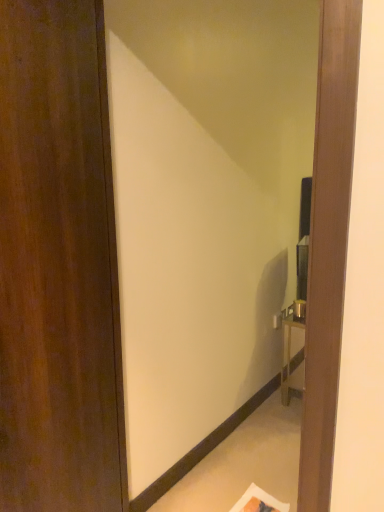
Question: Considering their positions, is matte wood mirror at center located in front of or behind dark wood door at left?

Choices:
 (A) behind
 (B) front

Answer: (A)

Question: Does point (286, 154) appear closer or farther from the camera than point (56, 396)?

Choices:
 (A) farther
 (B) closer

Answer: (A)

Question: From the image's perspective, is matte wood mirror at center located above or below dark wood door at left?

Choices:
 (A) above
 (B) below

Answer: (A)

Question: Would you say dark wood door at left is to the left or to the right of matte wood mirror at center in the picture?

Choices:
 (A) left
 (B) right

Answer: (A)

Question: Is dark wood door at left wider or thinner than matte wood mirror at center?

Choices:
 (A) wide
 (B) thin

Answer: (A)

Question: Is point (19, 168) closer or farther from the camera than point (195, 148)?

Choices:
 (A) farther
 (B) closer

Answer: (B)

Question: From their relative heights in the image, would you say dark wood door at left is taller or shorter than matte wood mirror at center?

Choices:
 (A) short
 (B) tall

Answer: (A)